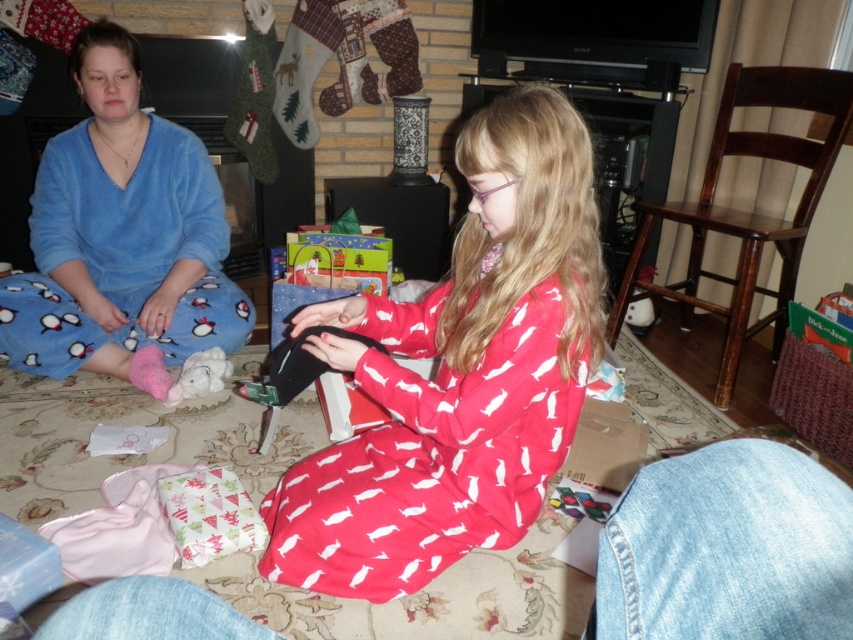
Looking at this image, between blue fleece pajamas at left and white plush toy at lower left, which one appears on the left side from the viewer's perspective?

From the viewer's perspective, blue fleece pajamas at left appears more on the left side.

Who is taller, blue fleece pajamas at left or white plush toy at lower left?

Standing taller between the two is blue fleece pajamas at left.

Does point (59, 307) come closer to viewer compared to point (175, 396)?

No, (59, 307) is further to viewer.

Image resolution: width=853 pixels, height=640 pixels. What are the coordinates of `blue fleece pajamas at left` in the screenshot? It's located at (120, 237).

Does matte black wallet at center have a smaller size compared to red cotton stocking at lower center?

Incorrect, matte black wallet at center is not smaller in size than red cotton stocking at lower center.

Does matte black wallet at center have a lesser width compared to red cotton stocking at lower center?

No.

Describe the element at coordinates (457, 372) in the screenshot. The image size is (853, 640). I see `matte black wallet at center` at that location.

Locate an element on the screen. This screenshot has width=853, height=640. matte black wallet at center is located at coordinates (457, 372).

Can you confirm if red cotton stocking at lower center is bigger than light blue denim stocking at lower right?

No.

Does red cotton stocking at lower center appear on the right side of light blue denim stocking at lower right?

No, red cotton stocking at lower center is not to the right of light blue denim stocking at lower right.

Which is behind, point (746, 632) or point (660, 474)?

Positioned behind is point (660, 474).

Locate an element on the screen. This screenshot has width=853, height=640. red cotton stocking at lower center is located at coordinates (727, 548).